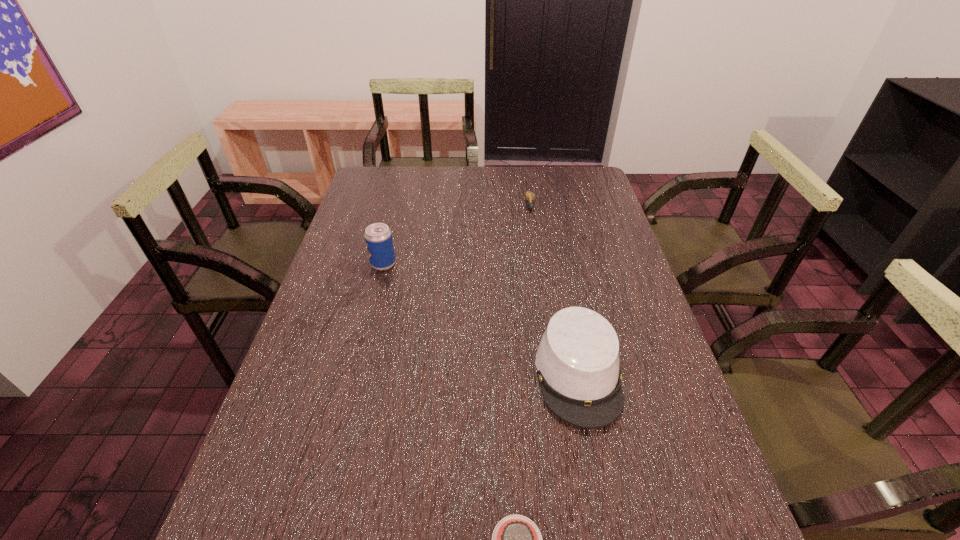
You are a GUI agent. You are given a task and a screenshot of the screen. Output one action in this format:
    pyautogui.click(x=<x>, y=<y>)
    Task: Click on the second farthest object
    
    Given the screenshot: What is the action you would take?
    pyautogui.click(x=378, y=237)

Image resolution: width=960 pixels, height=540 pixels. I want to click on the leftmost object, so click(378, 237).

Locate an element on the screen. The width and height of the screenshot is (960, 540). the third farthest object is located at coordinates (577, 360).

The image size is (960, 540). What are the coordinates of `the second tallest object` in the screenshot? It's located at (577, 360).

Find the location of a particular element. The image size is (960, 540). the farthest object is located at coordinates (530, 197).

This screenshot has width=960, height=540. I want to click on escargot, so click(530, 197).

The width and height of the screenshot is (960, 540). In order to click on vacant space situated 0.380m on the front of the second farthest object in this screenshot , I will do [355, 378].

The image size is (960, 540). In order to click on free space located on the front-facing side of the second tallest object in this screenshot , I will do `click(596, 465)`.

You are a GUI agent. You are given a task and a screenshot of the screen. Output one action in this format:
    pyautogui.click(x=<x>, y=<y>)
    Task: Click on the free region located on the front-facing side of the farthest object
    The height and width of the screenshot is (540, 960).
    Given the screenshot: What is the action you would take?
    pyautogui.click(x=540, y=271)

The width and height of the screenshot is (960, 540). I want to click on object at the left edge, so click(x=378, y=237).